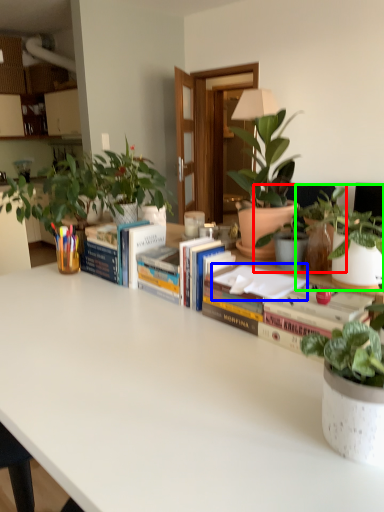
Question: Which object is the farthest from houseplant (highlighted by a red box)? Choose among these: paperback book (highlighted by a blue box) or houseplant (highlighted by a green box).

Choices:
 (A) paperback book
 (B) houseplant

Answer: (A)